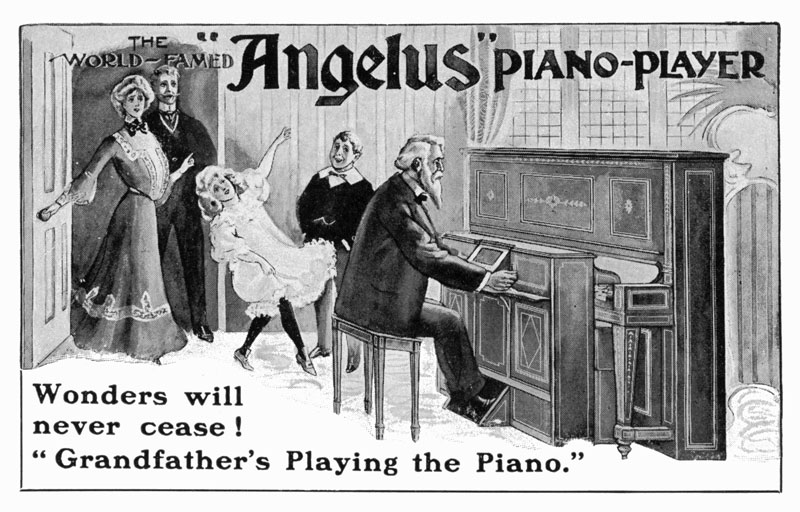
The image size is (800, 512). I want to click on door, so click(50, 110).